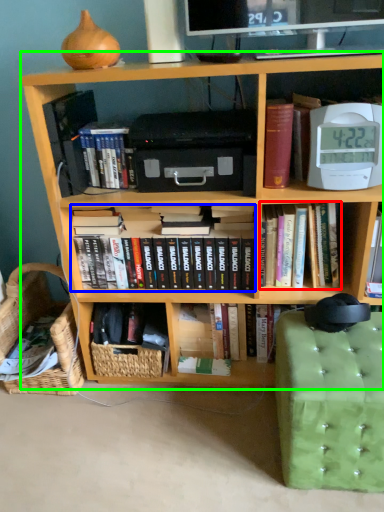
Question: Based on their relative distances, which object is nearer to book (highlighted by a red box)? Choose from book (highlighted by a blue box) and bookcase (highlighted by a green box).

Choices:
 (A) book
 (B) bookcase

Answer: (B)